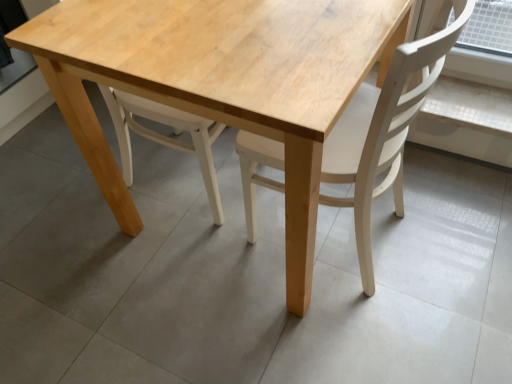
You are a GUI agent. You are given a task and a screenshot of the screen. Output one action in this format:
    pyautogui.click(x=<x>, y=<y>)
    Task: Click on the vacant point to the right of light wood chair at center
    The image size is (512, 384).
    Given the screenshot: What is the action you would take?
    pyautogui.click(x=450, y=221)